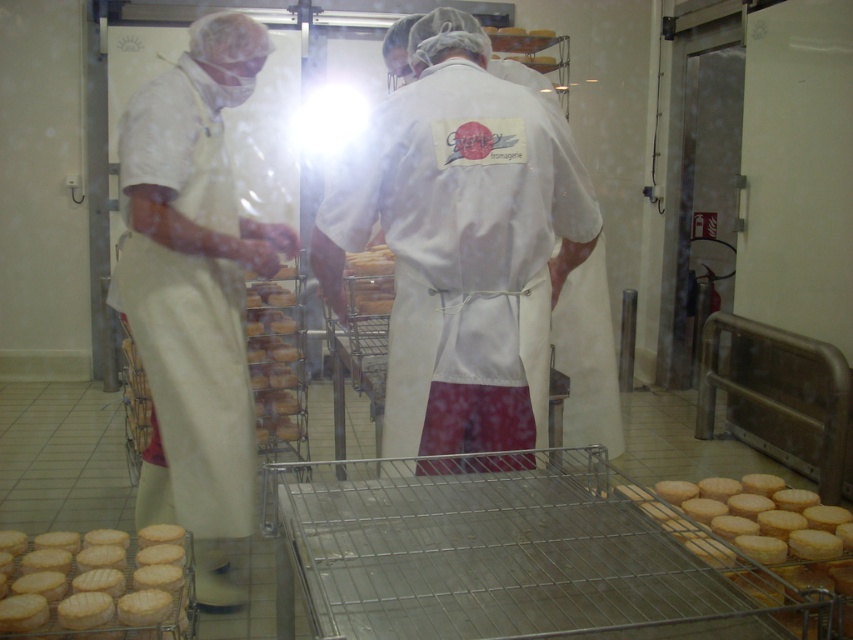
You are a quality control inspector in a cheese factory. You need to check the size of the golden brown cheese at lower left and the yellow matte cheese at lower right. Which cheese should you prioritize inspecting first based on their sizes?

The golden brown cheese at lower left has a larger size compared to the yellow matte cheese at lower right, so you should prioritize inspecting the golden brown cheese at lower left first because it is bigger and may require more thorough examination.

You are a quality inspector in the cheese facility. You need to compare the size of the white fabric coat at center and the yellow matte cheese at lower right. Which one is bigger?

The white fabric coat at center is larger in size than the yellow matte cheese at lower right.